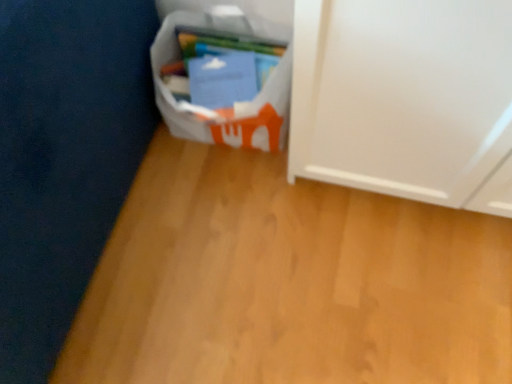
Measure the distance between point (x=179, y=131) and camera.

They are 1.16 meters apart.

At what (x,y) coordinates should I click in order to perform the action: click on white paper at lower left. Please return your answer as a coordinate pair (x, y). The image size is (512, 384). Looking at the image, I should click on (236, 104).

What do you see at coordinates (236, 104) in the screenshot?
I see `white paper at lower left` at bounding box center [236, 104].

You are a GUI agent. You are given a task and a screenshot of the screen. Output one action in this format:
    pyautogui.click(x=<x>, y=<y>)
    Task: Click on the white paper at lower left
    The image size is (512, 384).
    Given the screenshot: What is the action you would take?
    pyautogui.click(x=236, y=104)